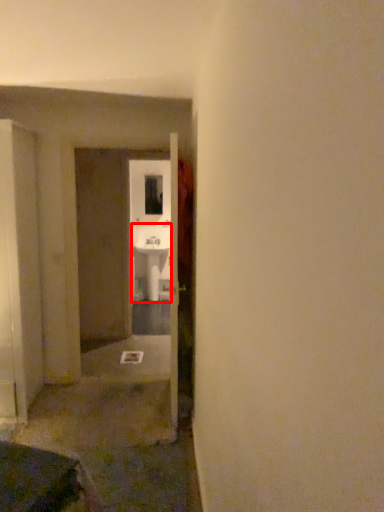
Question: From the image's perspective, considering the relative positions of sink (annotated by the red box) and window in the image provided, where is sink (annotated by the red box) located with respect to the staircase?

Choices:
 (A) below
 (B) above

Answer: (A)